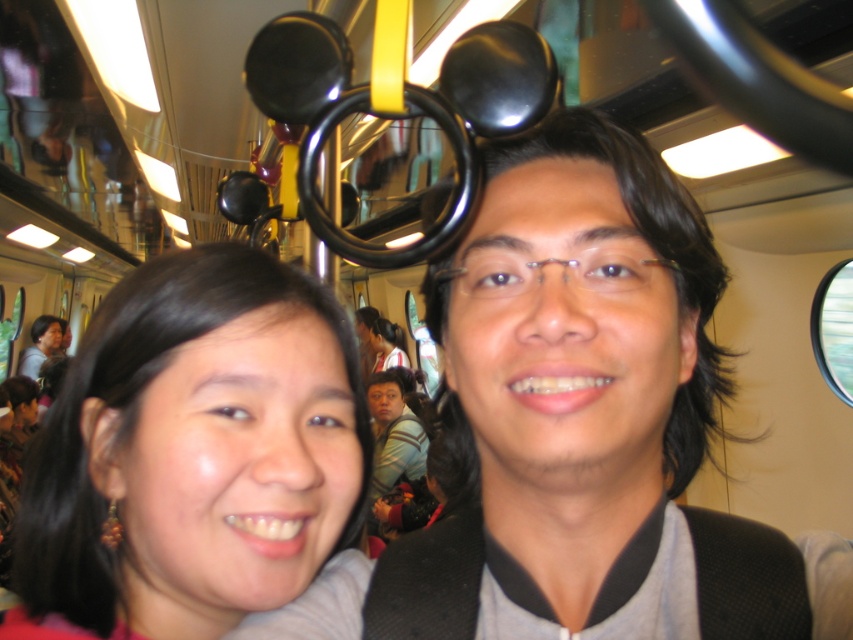
Looking at this image, does black fabric at center come behind matte gray shirt at upper left?

No.

Can you confirm if black fabric at center is wider than matte gray shirt at upper left?

No.

Does point (509, 589) come farther from viewer compared to point (20, 368)?

No, it is not.

At what (x,y) coordinates should I click in order to perform the action: click on black fabric at center. Please return your answer as a coordinate pair (x, y). Looking at the image, I should click on (563, 388).

Image resolution: width=853 pixels, height=640 pixels. What are the coordinates of `black fabric at center` in the screenshot? It's located at (563, 388).

What do you see at coordinates (563, 388) in the screenshot? I see `black fabric at center` at bounding box center [563, 388].

Which is in front, point (579, 449) or point (183, 417)?

Point (579, 449) is in front.

I want to click on black fabric at center, so click(x=563, y=388).

The width and height of the screenshot is (853, 640). What do you see at coordinates (193, 452) in the screenshot?
I see `black hair at center` at bounding box center [193, 452].

Who is higher up, black hair at center or matte gray shirt at upper left?

Positioned higher is black hair at center.

Describe the element at coordinates (193, 452) in the screenshot. I see `black hair at center` at that location.

Image resolution: width=853 pixels, height=640 pixels. I want to click on black hair at center, so click(x=193, y=452).